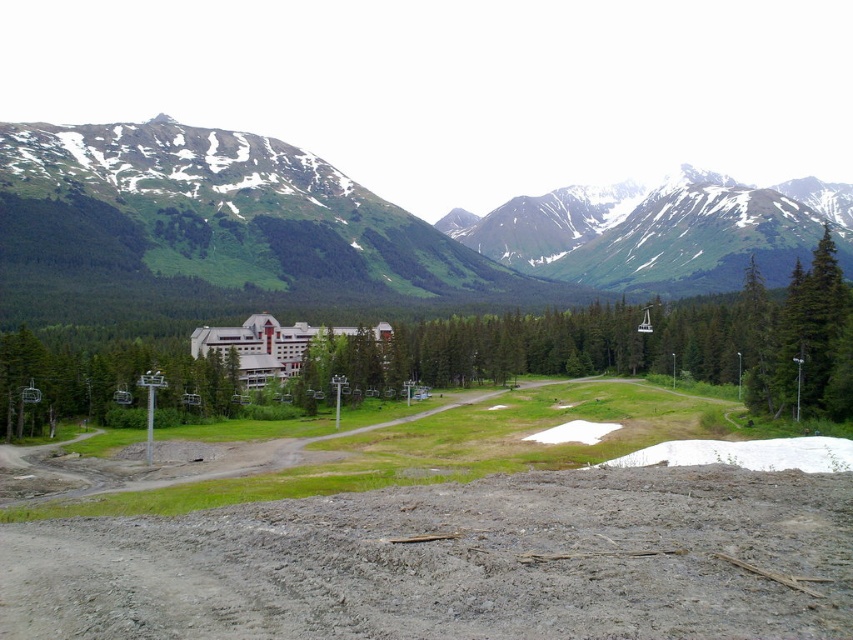
Between green matte tree at center and white matte hotel at center, which one appears on the right side from the viewer's perspective?

white matte hotel at center

From the picture: Is green matte tree at center wider than white matte hotel at center?

Yes, green matte tree at center is wider than white matte hotel at center.

Does point (33, 381) come farther from viewer compared to point (341, 328)?

No, it is not.

Identify the location of green matte tree at center. (105, 385).

Who is shorter, green grassy mountain at center or white matte hotel at center?

white matte hotel at center is shorter.

Is green grassy mountain at center to the left of white matte hotel at center from the viewer's perspective?

Incorrect, green grassy mountain at center is not on the left side of white matte hotel at center.

Find the location of `green grassy mountain at center`. green grassy mountain at center is located at coordinates pyautogui.click(x=314, y=234).

Between brown sandy dirt track at lower center and green grassy mountain at center, which one appears on the right side from the viewer's perspective?

brown sandy dirt track at lower center is more to the right.

Is brown sandy dirt track at lower center below green grassy mountain at center?

Correct, brown sandy dirt track at lower center is located below green grassy mountain at center.

Is point (753, 534) positioned after point (279, 273)?

No, it is in front of (279, 273).

The image size is (853, 640). I want to click on brown sandy dirt track at lower center, so click(456, 563).